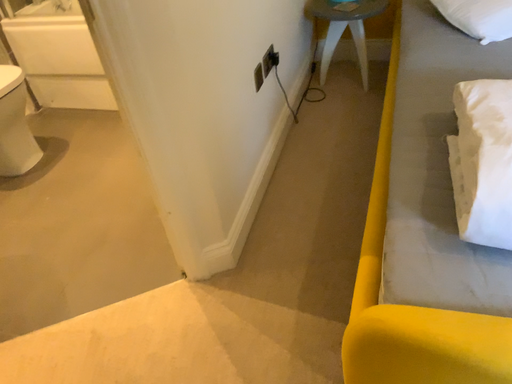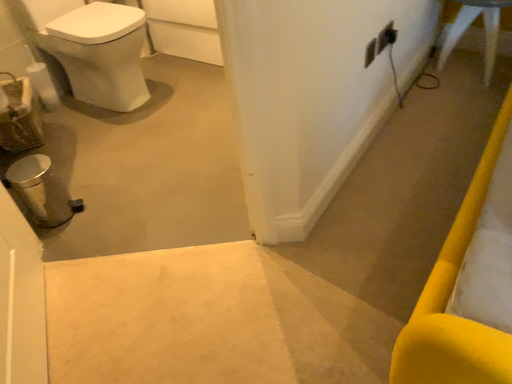
Question: How did the camera likely rotate when shooting the video?

Choices:
 (A) rotated left
 (B) rotated right

Answer: (A)